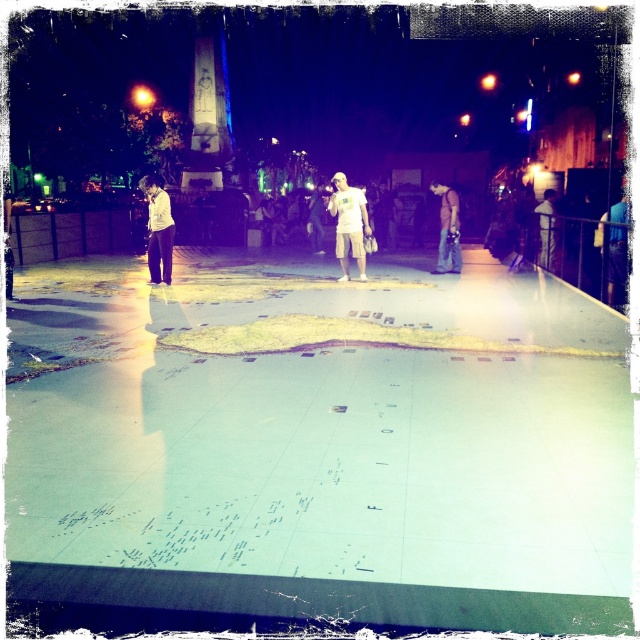
Which is below, denim jeans at center or light brown leather jacket at center?

denim jeans at center is below.

This screenshot has height=640, width=640. What do you see at coordinates (448, 228) in the screenshot? I see `denim jeans at center` at bounding box center [448, 228].

Find the location of `denim jeans at center`. denim jeans at center is located at coordinates (448, 228).

Is white matte shorts at center shorter than white matte shirt at center?

No, white matte shorts at center is not shorter than white matte shirt at center.

Is point (339, 227) positioned after point (164, 253)?

Yes, point (339, 227) is behind point (164, 253).

Between point (352, 230) and point (163, 237), which one is positioned behind?

The point (352, 230) is more distant.

Where is `white matte shorts at center`? The height and width of the screenshot is (640, 640). white matte shorts at center is located at coordinates (348, 225).

Is white matte shorts at center wider than light brown leather jacket at center?

Yes.

Which is in front, point (332, 179) or point (552, 262)?

Point (552, 262)

Who is more forward, (332, 209) or (548, 260)?

Point (332, 209) is more forward.

Locate an element on the screen. The width and height of the screenshot is (640, 640). white matte shorts at center is located at coordinates (348, 225).